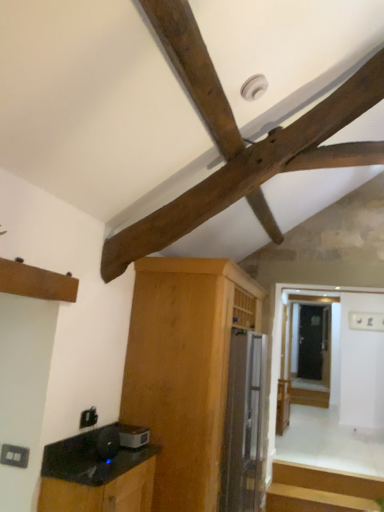
This screenshot has width=384, height=512. Find the location of `satin silver toaster at lower center, which is the 1th appliance from top to bottom`. satin silver toaster at lower center, which is the 1th appliance from top to bottom is located at coordinates (133, 436).

How much space does satin silver toaster at lower center, which appears as the first appliance when viewed from the left, occupy vertically?

satin silver toaster at lower center, which appears as the first appliance when viewed from the left, is 8.79 centimeters in height.

In order to click on light brown wood cabinet at center, acting as the 2th cabinetry starting from the front in this screenshot , I will do `click(185, 369)`.

In order to click on black glossy cabinet at lower left, which is counted as the second cabinetry, starting from the back in this screenshot , I will do `click(101, 493)`.

What do you see at coordinates (241, 143) in the screenshot? I see `dark brown wood at upper center` at bounding box center [241, 143].

At what (x,y) coordinates should I click in order to perform the action: click on satin silver refrigerator at center, which is the first appliance from back to front. Please return your answer as a coordinate pair (x, y). Looking at the image, I should click on (244, 424).

Locate an element on the screen. The height and width of the screenshot is (512, 384). satin silver toaster at lower center, the second appliance from the back is located at coordinates (133, 436).

Can we say satin silver toaster at lower center, which is counted as the 2th appliance, starting from the right, lies outside satin silver refrigerator at center, the 1th appliance viewed from the right?

satin silver toaster at lower center, which is counted as the 2th appliance, starting from the right, lies outside satin silver refrigerator at center, the 1th appliance viewed from the right,'s area.

Does satin silver toaster at lower center, which appears as the first appliance when viewed from the left, turn towards satin silver refrigerator at center, the 1th appliance viewed from the right?

No, satin silver toaster at lower center, which appears as the first appliance when viewed from the left, is not aimed at satin silver refrigerator at center, the 1th appliance viewed from the right.

Is satin silver toaster at lower center, which appears as the first appliance when viewed from the left, at the left side of satin silver refrigerator at center, the 1th appliance ordered from the bottom?

Yes, satin silver toaster at lower center, which appears as the first appliance when viewed from the left, is to the left of satin silver refrigerator at center, the 1th appliance ordered from the bottom.

Where is `appliance lying in front of the satin silver refrigerator at center, the 1th appliance viewed from the right`? This screenshot has width=384, height=512. appliance lying in front of the satin silver refrigerator at center, the 1th appliance viewed from the right is located at coordinates (133, 436).

Consider the image. Is satin silver refrigerator at center, the 1th appliance viewed from the right, to the right of satin silver toaster at lower center, the second appliance positioned from the bottom, from the viewer's perspective?

Correct, you'll find satin silver refrigerator at center, the 1th appliance viewed from the right, to the right of satin silver toaster at lower center, the second appliance positioned from the bottom.

From a real-world perspective, is satin silver refrigerator at center, the 1th appliance viewed from the right, physically located above or below satin silver toaster at lower center, which is the first appliance in front-to-back order?

satin silver refrigerator at center, the 1th appliance viewed from the right, is situated lower than satin silver toaster at lower center, which is the first appliance in front-to-back order, in the real world.

How many degrees apart are the facing directions of satin silver refrigerator at center, which is the first appliance from back to front, and satin silver toaster at lower center, the second appliance positioned from the bottom?

The angular difference between satin silver refrigerator at center, which is the first appliance from back to front, and satin silver toaster at lower center, the second appliance positioned from the bottom, is 3.65 degrees.

Considering the relative positions of satin silver refrigerator at center, the 1th appliance viewed from the right, and black glossy cabinet at lower left, which is counted as the second cabinetry, starting from the back, in the image provided, is satin silver refrigerator at center, the 1th appliance viewed from the right, behind black glossy cabinet at lower left, which is counted as the second cabinetry, starting from the back,?

Yes, it is.

From the image's perspective, count 1st cabinetrys upward from the satin silver refrigerator at center, the 2th appliance positioned from the front, and point to it. Please provide its 2D coordinates.

[(101, 493)]

Looking at their sizes, would you say satin silver refrigerator at center, the 2th appliance positioned from the front, is wider or thinner than black glossy cabinet at lower left, which is counted as the second cabinetry, starting from the back?

Clearly, satin silver refrigerator at center, the 2th appliance positioned from the front, has more width compared to black glossy cabinet at lower left, which is counted as the second cabinetry, starting from the back.

Could you measure the distance between satin silver refrigerator at center, the 1th appliance ordered from the bottom, and black glossy cabinet at lower left, which is counted as the second cabinetry, starting from the back?

93.25 centimeters.

Based on the photo, which object is thinner, satin silver toaster at lower center, which is the 1th appliance from top to bottom, or dark brown wood at upper center?

satin silver toaster at lower center, which is the 1th appliance from top to bottom.

Is satin silver toaster at lower center, which is counted as the 2th appliance, starting from the right, further to the viewer compared to dark brown wood at upper center?

Yes, satin silver toaster at lower center, which is counted as the 2th appliance, starting from the right, is further from the viewer.

Measure the distance between satin silver toaster at lower center, the second appliance from the back, and dark brown wood at upper center.

satin silver toaster at lower center, the second appliance from the back, is 5.07 feet from dark brown wood at upper center.

Image resolution: width=384 pixels, height=512 pixels. I want to click on the 1st appliance directly beneath the dark brown wood at upper center (from a real-world perspective), so click(133, 436).

Considering the relative sizes of dark brown wood at upper center and satin silver toaster at lower center, which appears as the first appliance when viewed from the left, in the image provided, is dark brown wood at upper center smaller than satin silver toaster at lower center, which appears as the first appliance when viewed from the left,?

Incorrect, dark brown wood at upper center is not smaller in size than satin silver toaster at lower center, which appears as the first appliance when viewed from the left.

Who is taller, dark brown wood at upper center or satin silver toaster at lower center, which is the first appliance in front-to-back order?

dark brown wood at upper center is taller.

Is dark brown wood at upper center spatially inside satin silver toaster at lower center, which appears as the first appliance when viewed from the left, or outside of it?

dark brown wood at upper center is outside satin silver toaster at lower center, which appears as the first appliance when viewed from the left.

Who is taller, light brown wood cabinet at center, acting as the 2th cabinetry starting from the front, or dark brown wood at upper center?

Standing taller between the two is light brown wood cabinet at center, acting as the 2th cabinetry starting from the front.

From the image's perspective, which one is positioned higher, light brown wood cabinet at center, acting as the 2th cabinetry starting from the front, or dark brown wood at upper center?

dark brown wood at upper center appears higher in the image.

Would you say light brown wood cabinet at center, acting as the 2th cabinetry starting from the front, is outside dark brown wood at upper center?

light brown wood cabinet at center, acting as the 2th cabinetry starting from the front, is positioned outside dark brown wood at upper center.

Can you confirm if light brown wood cabinet at center, marked as the first cabinetry in a back-to-front arrangement, is smaller than dark brown wood at upper center?

No.

Considering the relative positions of satin silver refrigerator at center, the 1th appliance ordered from the bottom, and dark brown wood at upper center in the image provided, is satin silver refrigerator at center, the 1th appliance ordered from the bottom, to the left or to the right of dark brown wood at upper center?

Clearly, satin silver refrigerator at center, the 1th appliance ordered from the bottom, is on the right of dark brown wood at upper center in the image.

Can you confirm if satin silver refrigerator at center, which appears as the second appliance when viewed from the left, is shorter than dark brown wood at upper center?

Indeed, satin silver refrigerator at center, which appears as the second appliance when viewed from the left, has a lesser height compared to dark brown wood at upper center.

Considering the sizes of objects satin silver refrigerator at center, the 2th appliance when ordered from top to bottom, and dark brown wood at upper center in the image provided, who is smaller, satin silver refrigerator at center, the 2th appliance when ordered from top to bottom, or dark brown wood at upper center?

Smaller between the two is dark brown wood at upper center.

The height and width of the screenshot is (512, 384). What are the coordinates of `appliance that is above the satin silver refrigerator at center, which appears as the second appliance when viewed from the left (from the image's perspective)` in the screenshot? It's located at (133, 436).

Locate an element on the screen. This screenshot has width=384, height=512. appliance on the right of satin silver toaster at lower center, the second appliance positioned from the bottom is located at coordinates (244, 424).

When comparing their distances from satin silver toaster at lower center, which is the first appliance in front-to-back order, does black glossy cabinet at lower left, which is the 1th cabinetry from front to back, or light brown wood cabinet at center, marked as the first cabinetry in a back-to-front arrangement, seem closer?

black glossy cabinet at lower left, which is the 1th cabinetry from front to back, is closer to satin silver toaster at lower center, which is the first appliance in front-to-back order.

When comparing their distances from black glossy cabinet at lower left, which is the 1th cabinetry from front to back, does satin silver toaster at lower center, which is the 1th appliance from top to bottom, or dark brown wood at upper center seem further?

dark brown wood at upper center is positioned further to the anchor black glossy cabinet at lower left, which is the 1th cabinetry from front to back.

Looking at the image, which one is located further to satin silver refrigerator at center, the 1th appliance viewed from the right, light brown wood cabinet at center, marked as the first cabinetry in a back-to-front arrangement, or satin silver toaster at lower center, which is the 1th appliance from top to bottom?

Based on the image, satin silver toaster at lower center, which is the 1th appliance from top to bottom, appears to be further to satin silver refrigerator at center, the 1th appliance viewed from the right.

Considering their positions, is light brown wood cabinet at center, marked as the first cabinetry in a back-to-front arrangement, positioned further to satin silver refrigerator at center, the 2th appliance positioned from the front, than black glossy cabinet at lower left, which is counted as the second cabinetry, starting from the back?

Based on the image, black glossy cabinet at lower left, which is counted as the second cabinetry, starting from the back, appears to be further to satin silver refrigerator at center, the 2th appliance positioned from the front.

When comparing their distances from black glossy cabinet at lower left, which is the 1th cabinetry from front to back, does light brown wood cabinet at center, marked as the first cabinetry in a back-to-front arrangement, or dark brown wood at upper center seem closer?

light brown wood cabinet at center, marked as the first cabinetry in a back-to-front arrangement.

Estimate the real-world distances between objects in this image. Which object is closer to black glossy cabinet at lower left, which is the 1th cabinetry from front to back, dark brown wood at upper center or satin silver refrigerator at center, which is the first appliance from back to front?

satin silver refrigerator at center, which is the first appliance from back to front, lies closer to black glossy cabinet at lower left, which is the 1th cabinetry from front to back, than the other object.

Looking at the image, which one is located closer to black glossy cabinet at lower left, which is the 1th cabinetry from front to back, light brown wood cabinet at center, marked as the first cabinetry in a back-to-front arrangement, or satin silver toaster at lower center, which is the first appliance in front-to-back order?

satin silver toaster at lower center, which is the first appliance in front-to-back order.

Based on their spatial positions, is satin silver refrigerator at center, the 1th appliance viewed from the right, or satin silver toaster at lower center, which is the 1th appliance from top to bottom, closer to dark brown wood at upper center?

satin silver refrigerator at center, the 1th appliance viewed from the right, is closer to dark brown wood at upper center.

Where is `cabinetry positioned between black glossy cabinet at lower left, which is counted as the second cabinetry, starting from the back, and satin silver toaster at lower center, which is the first appliance in front-to-back order, from near to far`? The height and width of the screenshot is (512, 384). cabinetry positioned between black glossy cabinet at lower left, which is counted as the second cabinetry, starting from the back, and satin silver toaster at lower center, which is the first appliance in front-to-back order, from near to far is located at coordinates (185, 369).

The width and height of the screenshot is (384, 512). I want to click on cabinetry situated between satin silver toaster at lower center, the second appliance positioned from the bottom, and satin silver refrigerator at center, the 2th appliance positioned from the front, from left to right, so click(185, 369).

Locate an element on the screen. Image resolution: width=384 pixels, height=512 pixels. appliance between dark brown wood at upper center and black glossy cabinet at lower left, which is counted as the second cabinetry, starting from the back, in the vertical direction is located at coordinates (133, 436).

I want to click on cabinetry between black glossy cabinet at lower left, which is counted as the second cabinetry, starting from the back, and satin silver refrigerator at center, which is the first appliance from back to front, in the front-back direction, so click(185, 369).